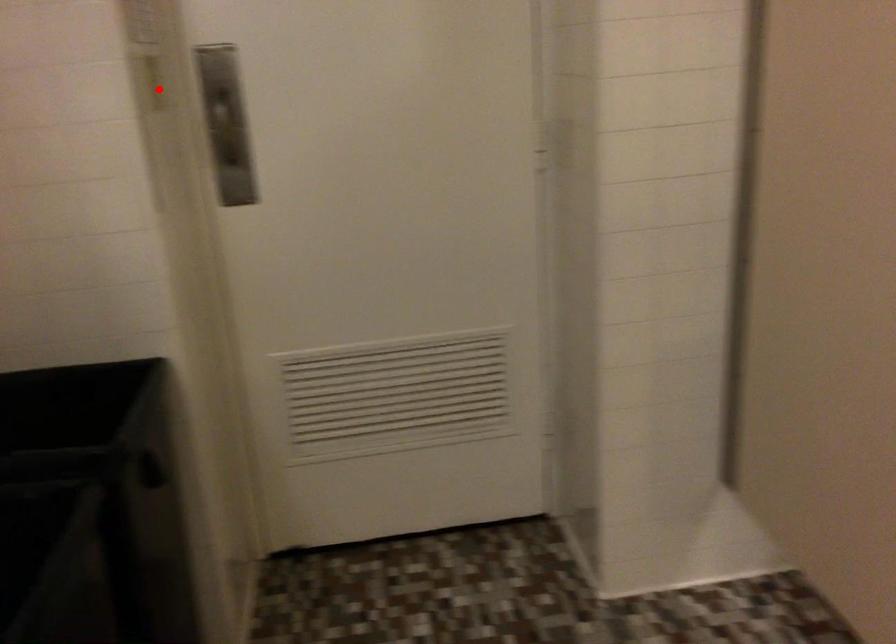
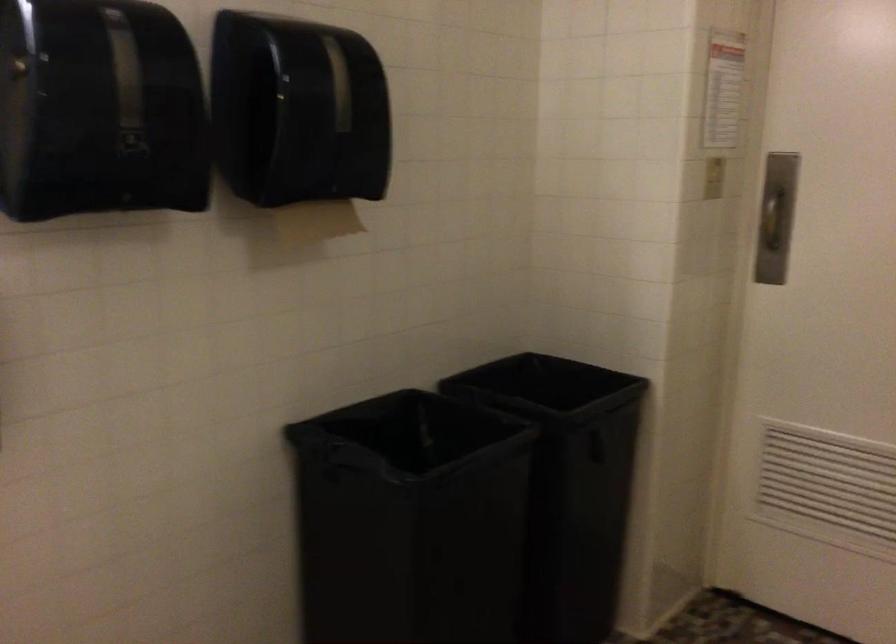
Question: A red point is marked in image1. In image2, is the corresponding 3D point closer to the camera or farther? Reply with the corresponding letter.

Choices:
 (A) The corresponding 3D point is closer.
 (B) The corresponding 3D point is farther.

Answer: (B)